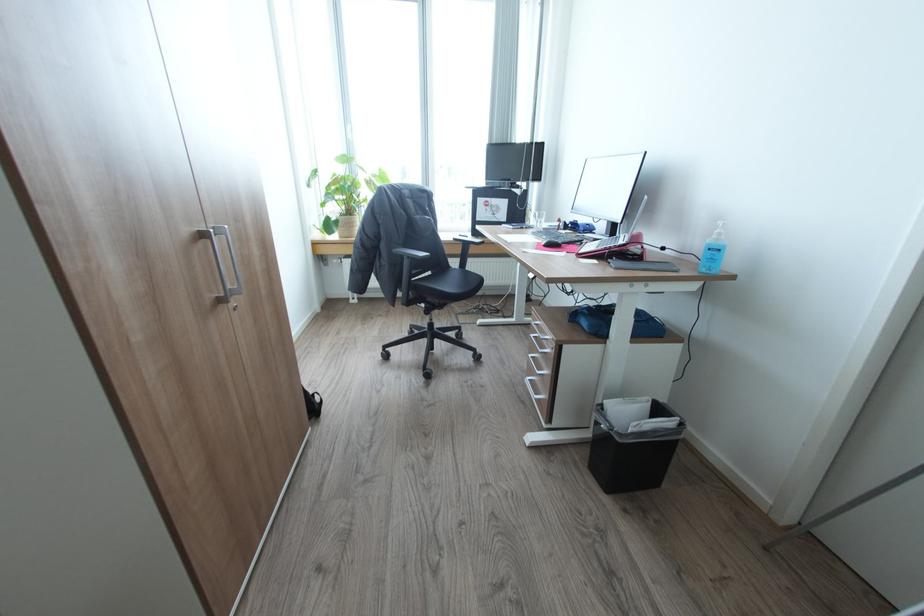
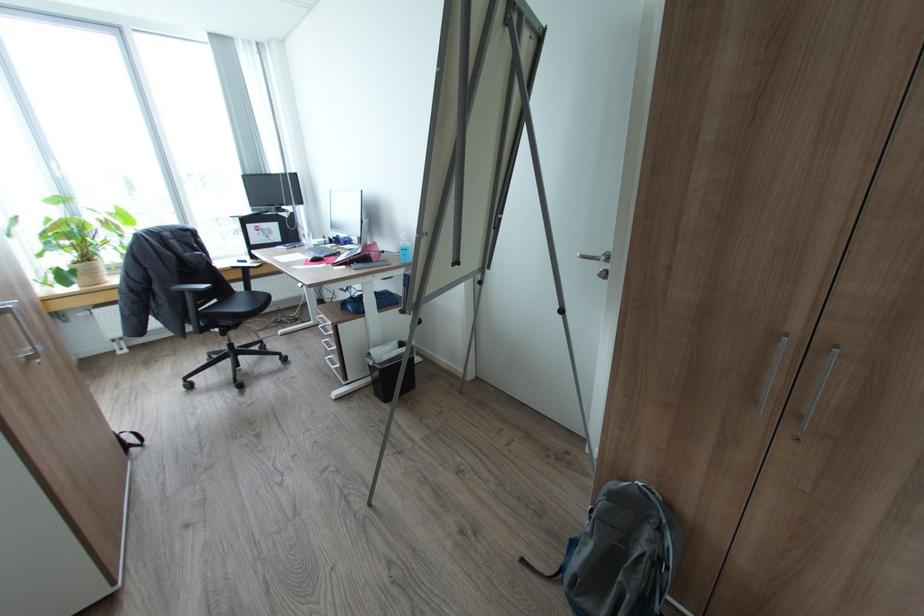
In the second image, find the point that corresponds to [608,426] in the first image.

(374, 363)